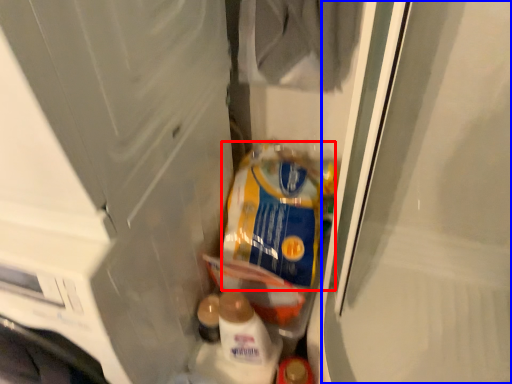
Question: Which point is closer to the camera, product (highlighted by a red box) or screen door (highlighted by a blue box)?

Choices:
 (A) product
 (B) screen door

Answer: (B)